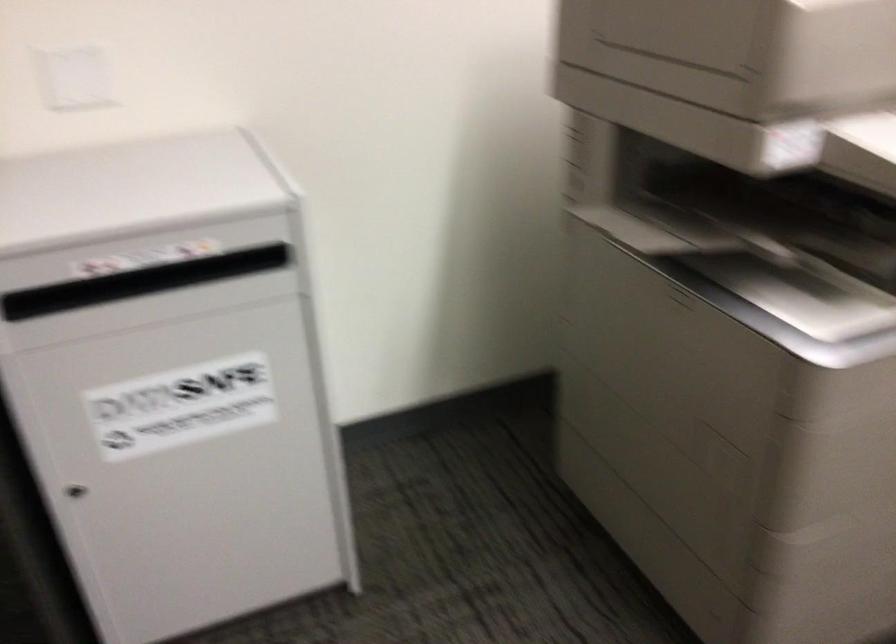
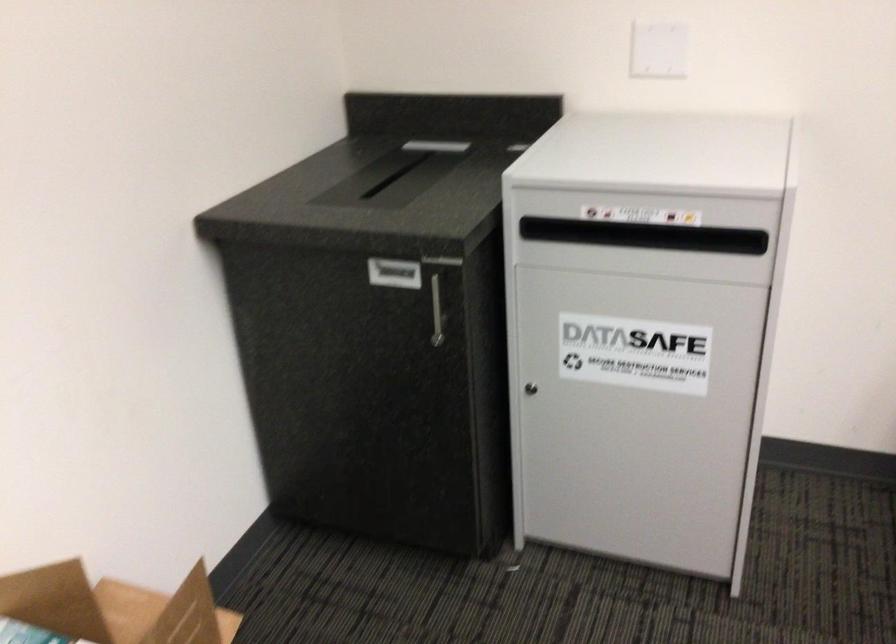
The point at (131, 278) is marked in the first image. Where is the corresponding point in the second image?

(644, 236)